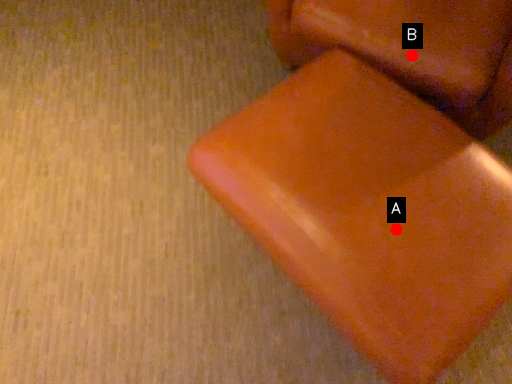
Question: Two points are circled on the image, labeled by A and B beside each circle. Which point is closer to the camera?

Choices:
 (A) A is closer
 (B) B is closer

Answer: (A)